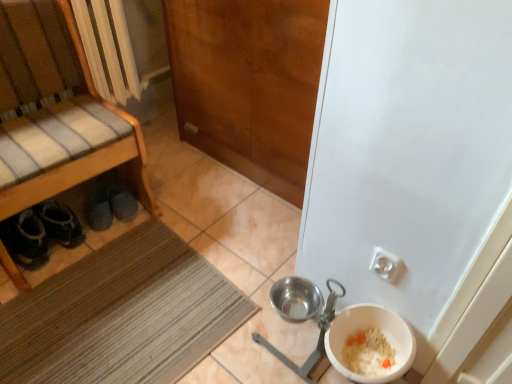
The width and height of the screenshot is (512, 384). Find the location of `empty space that is ontop of brown textured mat at lower left (from a real-world perspective)`. empty space that is ontop of brown textured mat at lower left (from a real-world perspective) is located at coordinates point(122,313).